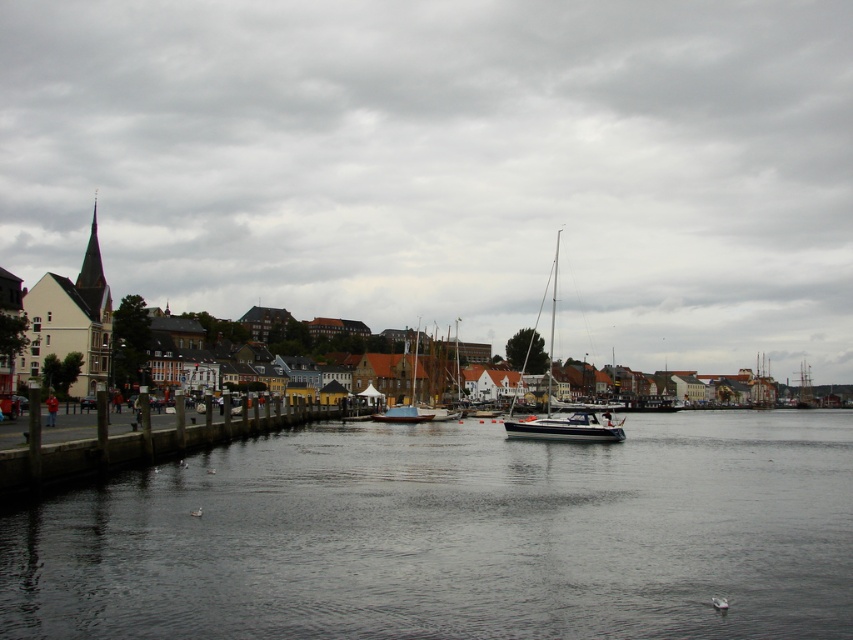
You are a photographer planning to capture the waterfront scene. You want to ensure both the concrete dock at left and the white glossy sailboat at center are clearly visible in your shot. Given their sizes, which object should you position closer to the camera to maintain clarity?

The concrete dock at left is smaller than the white glossy sailboat at center. To maintain clarity for both, you should position the concrete dock at left closer to the camera since it is smaller and might otherwise appear too tiny in the frame compared to the larger sailboat.

You are an architect planning to install a large solar panel array on the roof of a building in this waterfront area. Considering the cloudy sky at upper center and the concrete dock at left, which object would cast a longer shadow during midday? Please explain your reasoning based on their sizes and positions.

The cloudy sky at upper center has a larger size compared to the concrete dock at left. Since the sky is overhead, its larger expanse would create a more diffuse shadow, but shadows are typically cast by objects blocking light. However, the concrete dock at left, being a solid structure, would cast a distinct shadow. However, the question might be a trick since the sky itself doesn

You are standing on the concrete dock at left and looking up at the cloudy sky at upper center. Which one appears wider from your perspective?

The cloudy sky at upper center appears wider than the concrete dock at left from your perspective because its width is larger than that of the concrete dock at left.